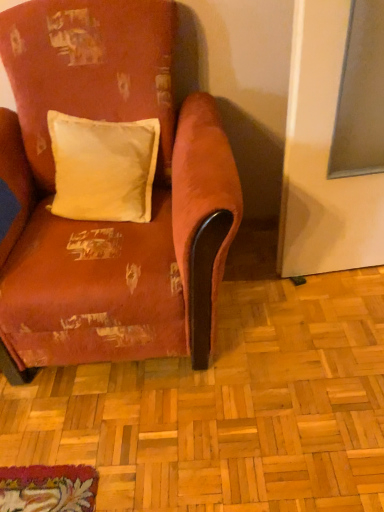
Question: From a real-world perspective, does white cotton pillow at center sit lower than velvet-like red armchair at center?

Choices:
 (A) yes
 (B) no

Answer: (B)

Question: Considering the relative sizes of white cotton pillow at center and velvet-like red armchair at center in the image provided, is white cotton pillow at center wider than velvet-like red armchair at center?

Choices:
 (A) yes
 (B) no

Answer: (B)

Question: From the image's perspective, is white cotton pillow at center under velvet-like red armchair at center?

Choices:
 (A) yes
 (B) no

Answer: (B)

Question: From a real-world perspective, is white cotton pillow at center over velvet-like red armchair at center?

Choices:
 (A) no
 (B) yes

Answer: (B)

Question: Could velvet-like red armchair at center be considered to be inside white cotton pillow at center?

Choices:
 (A) yes
 (B) no

Answer: (B)

Question: Is white cotton pillow at center at the left side of velvet-like red armchair at center?

Choices:
 (A) no
 (B) yes

Answer: (A)

Question: Is velvet-like red armchair at center at the right side of white cotton pillow at center?

Choices:
 (A) no
 (B) yes

Answer: (A)

Question: Are velvet-like red armchair at center and white cotton pillow at center far apart?

Choices:
 (A) yes
 (B) no

Answer: (B)

Question: Is velvet-like red armchair at center bigger than white cotton pillow at center?

Choices:
 (A) no
 (B) yes

Answer: (B)

Question: Are velvet-like red armchair at center and white cotton pillow at center beside each other?

Choices:
 (A) no
 (B) yes

Answer: (A)

Question: Is velvet-like red armchair at center facing away from white cotton pillow at center?

Choices:
 (A) yes
 (B) no

Answer: (A)

Question: Is velvet-like red armchair at center further to camera compared to white cotton pillow at center?

Choices:
 (A) yes
 (B) no

Answer: (B)

Question: Is white cotton pillow at center bigger or smaller than velvet-like red armchair at center?

Choices:
 (A) big
 (B) small

Answer: (B)